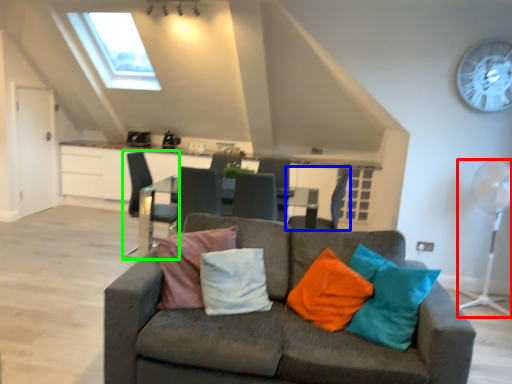
Question: Which object is the farthest from mechanical fan (highlighted by a red box)? Choose among these: chair (highlighted by a blue box) or chair (highlighted by a green box).

Choices:
 (A) chair
 (B) chair

Answer: (B)